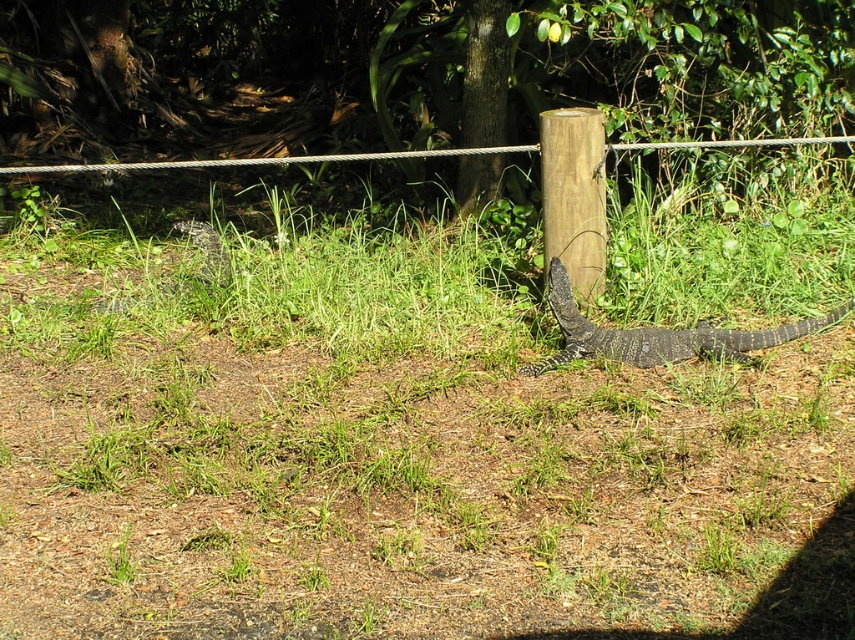
Question: Which object is positioned closest to the wooden post at center?

Choices:
 (A) dark gray scaly lizard at lower right
 (B) dark gray scaly lizard at center

Answer: (A)

Question: Is dark gray scaly lizard at lower right in front of dark gray scaly lizard at center?

Choices:
 (A) no
 (B) yes

Answer: (B)

Question: Is wooden post at center to the left of dark gray scaly lizard at center from the viewer's perspective?

Choices:
 (A) yes
 (B) no

Answer: (B)

Question: Based on their relative distances, which object is nearer to the wooden post at center?

Choices:
 (A) dark gray scaly lizard at lower right
 (B) dark gray scaly lizard at center

Answer: (A)

Question: Which is farther from the dark gray scaly lizard at lower right?

Choices:
 (A) wooden post at center
 (B) dark gray scaly lizard at center

Answer: (B)

Question: Is dark gray scaly lizard at lower right to the right of dark gray scaly lizard at center from the viewer's perspective?

Choices:
 (A) yes
 (B) no

Answer: (A)